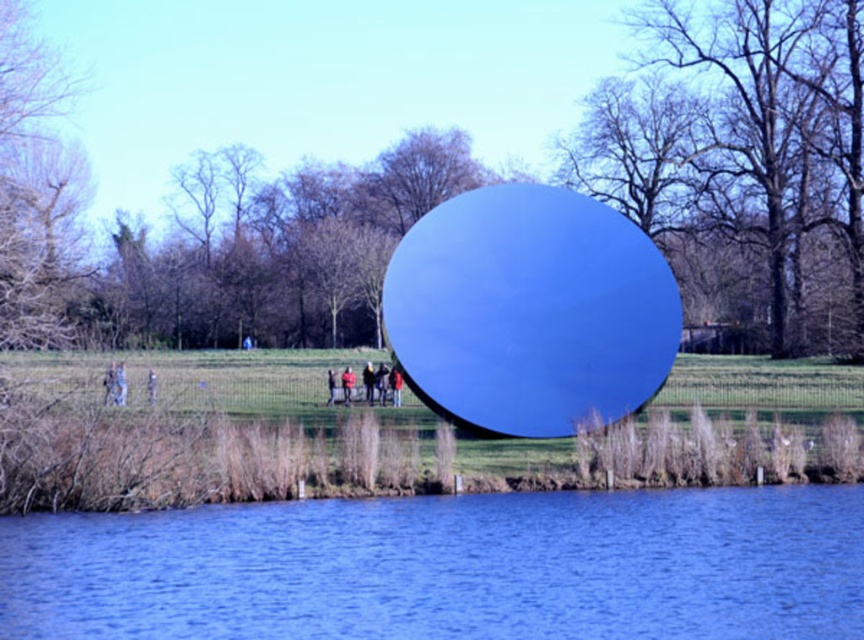
You are standing at the edge of the water in the foreground and want to walk directly to the blue liquid at center. What are the coordinates of the point you need to aim for?

The coordinates of the blue liquid at center are at point (448, 568), so you should aim for that point.

Looking at this image, you are standing in the outdoor scene and see the blue liquid at center and the red jacket at center. Which object is closer to the ground?

The blue liquid at center is closer to the ground because it is positioned below the red jacket at center.